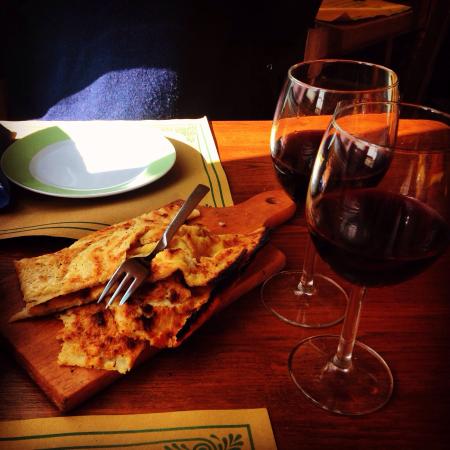
This screenshot has width=450, height=450. Find the location of `wooden serving board`. wooden serving board is located at coordinates (238, 216).